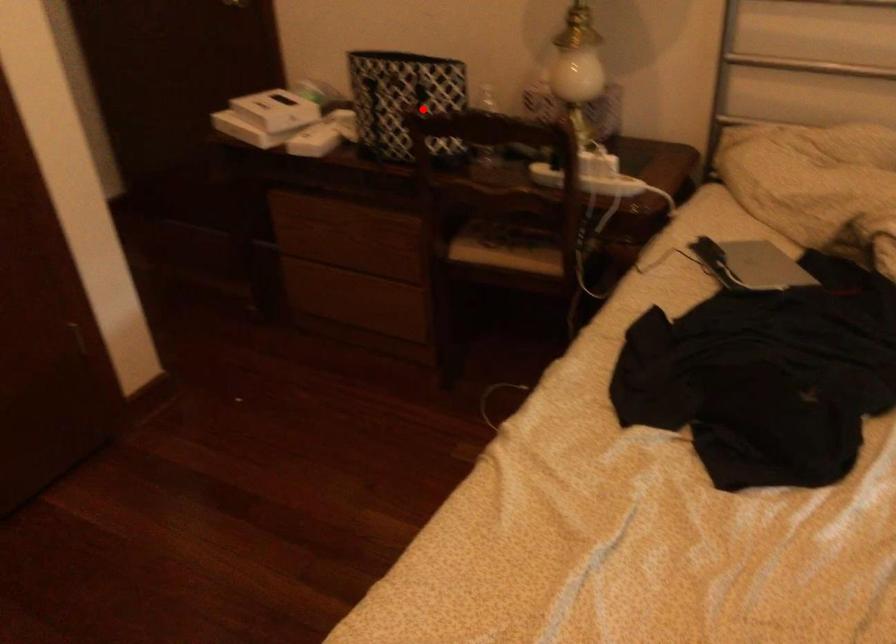
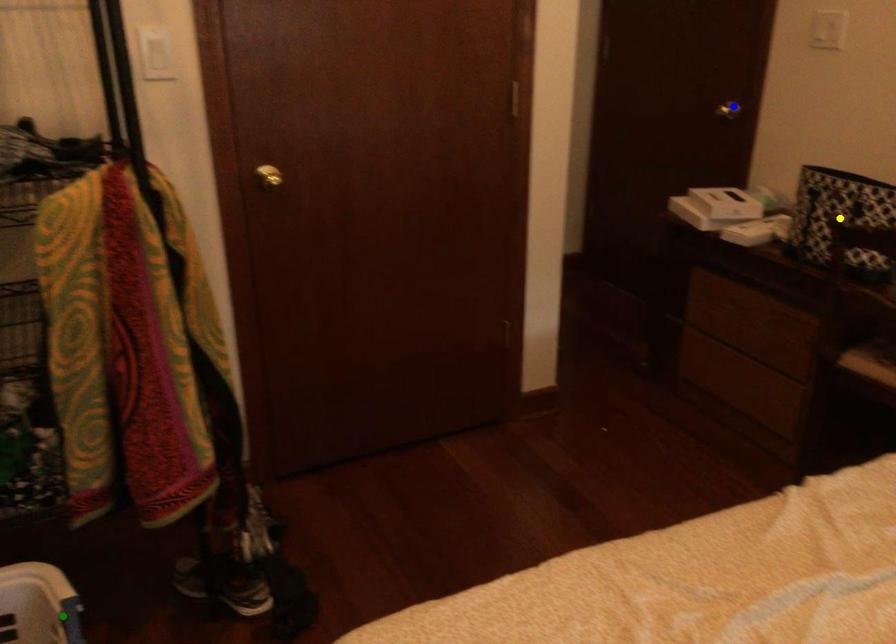
Question: I am providing you with two images of the same scene from different viewpoints. A red point is marked on the first image. You are given multiple points on the second image. Which point in image 2 represents the same 3d spot as the red point in image 1?

Choices:
 (A) green point
 (B) yellow point
 (C) blue point

Answer: (B)